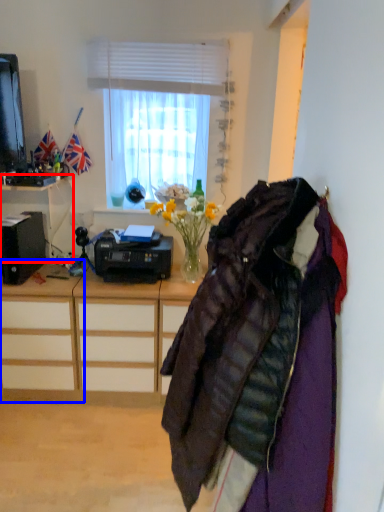
Question: Among these objects, which one is nearest to the camera, desk (highlighted by a red box) or desk (highlighted by a blue box)?

Choices:
 (A) desk
 (B) desk

Answer: (A)